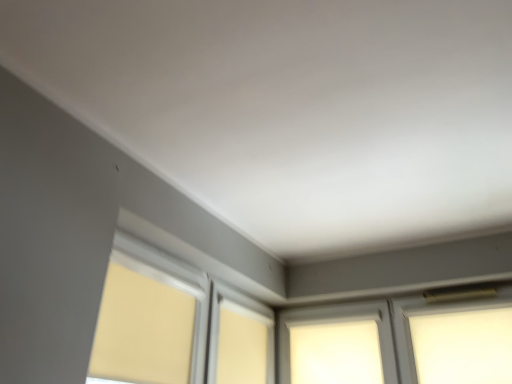
Question: From the image's perspective, is matte yellow roller shade at lower left over white frosted glass at upper right, placed as the second window when sorted from left to right?

Choices:
 (A) yes
 (B) no

Answer: (A)

Question: Does matte yellow roller shade at lower left touch white frosted glass at upper right, placed as the second window when sorted from left to right?

Choices:
 (A) no
 (B) yes

Answer: (A)

Question: From a real-world perspective, is matte yellow roller shade at lower left on white frosted glass at upper right, placed as the second window when sorted from left to right?

Choices:
 (A) no
 (B) yes

Answer: (A)

Question: From the image's perspective, is matte yellow roller shade at lower left under white frosted glass at upper right, which appears as the 1th window when viewed from the right?

Choices:
 (A) yes
 (B) no

Answer: (B)

Question: Can you confirm if matte yellow roller shade at lower left is positioned to the left of white frosted glass at upper right, placed as the second window when sorted from left to right?

Choices:
 (A) no
 (B) yes

Answer: (B)

Question: Considering the relative positions of white frosted glass at center, acting as the first window starting from the left, and matte yellow roller shade at lower left in the image provided, is white frosted glass at center, acting as the first window starting from the left, to the left or to the right of matte yellow roller shade at lower left?

Choices:
 (A) right
 (B) left

Answer: (A)

Question: In terms of size, does white frosted glass at center, the 2th window in the right-to-left sequence, appear bigger or smaller than matte yellow roller shade at lower left?

Choices:
 (A) big
 (B) small

Answer: (A)

Question: From a real-world perspective, is white frosted glass at center, the 2th window in the right-to-left sequence, physically located above or below matte yellow roller shade at lower left?

Choices:
 (A) above
 (B) below

Answer: (A)

Question: Is point (281, 321) closer or farther from the camera than point (120, 284)?

Choices:
 (A) closer
 (B) farther

Answer: (B)

Question: In terms of size, does matte yellow roller shade at lower left appear bigger or smaller than white frosted glass at center, the 2th window in the right-to-left sequence?

Choices:
 (A) small
 (B) big

Answer: (A)

Question: Is point (169, 314) closer or farther from the camera than point (367, 365)?

Choices:
 (A) closer
 (B) farther

Answer: (A)

Question: Is matte yellow roller shade at lower left inside or outside of white frosted glass at center, the 2th window in the right-to-left sequence?

Choices:
 (A) inside
 (B) outside

Answer: (B)

Question: In the image, is matte yellow roller shade at lower left on the left side or the right side of white frosted glass at center, the 2th window in the right-to-left sequence?

Choices:
 (A) left
 (B) right

Answer: (A)

Question: Is white frosted glass at center, acting as the first window starting from the left, wider or thinner than white frosted glass at upper right, which appears as the 1th window when viewed from the right?

Choices:
 (A) thin
 (B) wide

Answer: (B)

Question: From the image's perspective, is white frosted glass at center, the 2th window in the right-to-left sequence, located above or below white frosted glass at upper right, which appears as the 1th window when viewed from the right?

Choices:
 (A) below
 (B) above

Answer: (A)